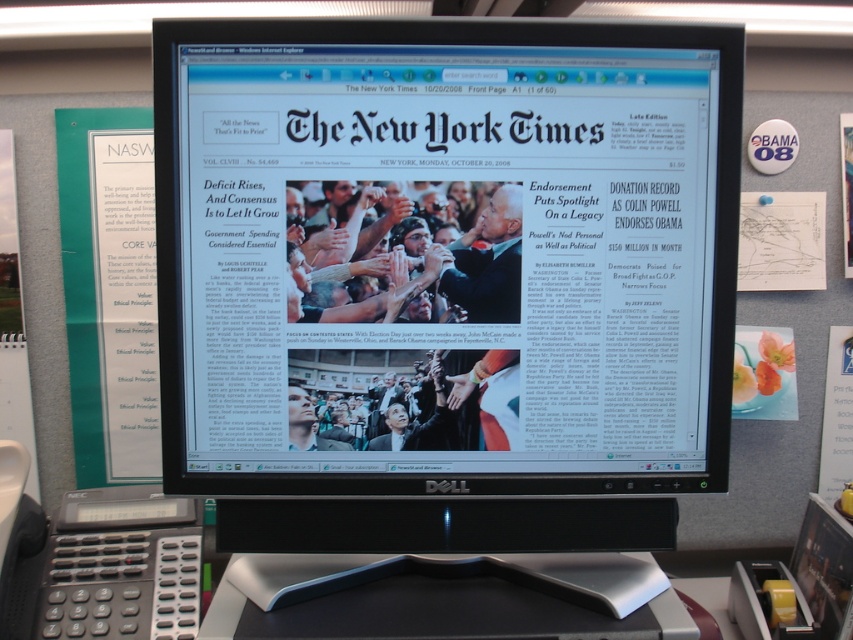
Question: Which of the following is the farthest from the observer?

Choices:
 (A) silver/black plastic at center
 (B) black plastic monitor at center

Answer: (B)

Question: Is black plastic monitor at center thinner than silver/black plastic at center?

Choices:
 (A) yes
 (B) no

Answer: (B)

Question: Is black plastic monitor at center thinner than silver/black plastic at center?

Choices:
 (A) yes
 (B) no

Answer: (B)

Question: Among these points, which one is nearest to the camera?

Choices:
 (A) (425, 628)
 (B) (563, 81)

Answer: (A)

Question: Can you confirm if black plastic monitor at center is wider than silver/black plastic at center?

Choices:
 (A) no
 (B) yes

Answer: (B)